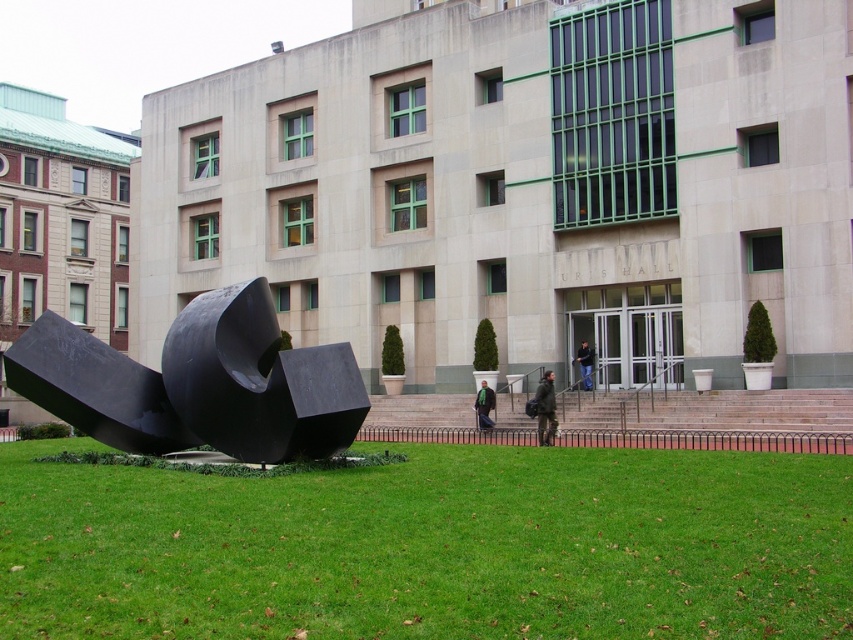
Question: Is black polished sculpture at lower left behind dark gray fabric jacket at center?

Choices:
 (A) no
 (B) yes

Answer: (A)

Question: From the image, what is the correct spatial relationship of green grass at lower center in relation to dark gray fabric jacket at center?

Choices:
 (A) right
 (B) left

Answer: (B)

Question: Which of the following is the farthest from the observer?

Choices:
 (A) green grass at lower center
 (B) black polished sculpture at lower left

Answer: (B)

Question: Which point is closer to the camera?

Choices:
 (A) black polished sculpture at lower left
 (B) green grass at lower center
 (C) dark green jacket at center

Answer: (B)

Question: From the image, what is the correct spatial relationship of dark gray fabric jacket at center in relation to dark green jacket at entrance?

Choices:
 (A) left
 (B) right

Answer: (A)

Question: Which of the following is the closest to the observer?

Choices:
 (A) (538, 380)
 (B) (315, 400)
 (C) (311, 564)
 (D) (491, 428)

Answer: (C)